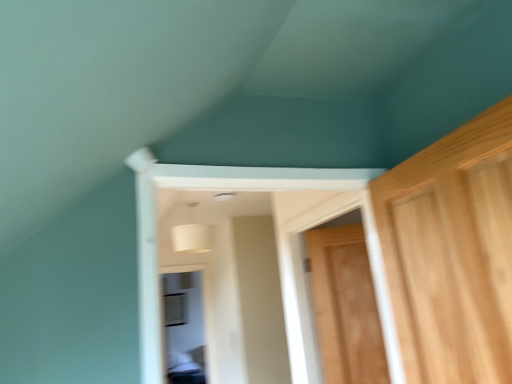
Question: Is transparent glass window at center oriented towards wooden door at right?

Choices:
 (A) yes
 (B) no

Answer: (A)

Question: Is transparent glass window at center smaller than wooden door at right?

Choices:
 (A) no
 (B) yes

Answer: (A)

Question: From the image's perspective, does transparent glass window at center appear lower than wooden door at right?

Choices:
 (A) no
 (B) yes

Answer: (B)

Question: Is transparent glass window at center not within wooden door at right?

Choices:
 (A) yes
 (B) no

Answer: (A)

Question: Considering the relative sizes of transparent glass window at center and wooden door at right in the image provided, is transparent glass window at center wider than wooden door at right?

Choices:
 (A) no
 (B) yes

Answer: (B)

Question: Can you confirm if transparent glass window at center is bigger than wooden door at right?

Choices:
 (A) no
 (B) yes

Answer: (B)

Question: From the image's perspective, is wooden door at right located beneath transparent glass window at center?

Choices:
 (A) no
 (B) yes

Answer: (A)

Question: Does wooden door at right lie behind transparent glass window at center?

Choices:
 (A) yes
 (B) no

Answer: (B)

Question: Is wooden door at right to the left of transparent glass window at center from the viewer's perspective?

Choices:
 (A) no
 (B) yes

Answer: (A)

Question: From the image's perspective, is wooden door at right over transparent glass window at center?

Choices:
 (A) no
 (B) yes

Answer: (B)

Question: Does wooden door at right have a greater width compared to transparent glass window at center?

Choices:
 (A) yes
 (B) no

Answer: (B)

Question: Is wooden door at right turned away from transparent glass window at center?

Choices:
 (A) yes
 (B) no

Answer: (B)

Question: Is wooden door at right taller or shorter than transparent glass window at center?

Choices:
 (A) short
 (B) tall

Answer: (A)